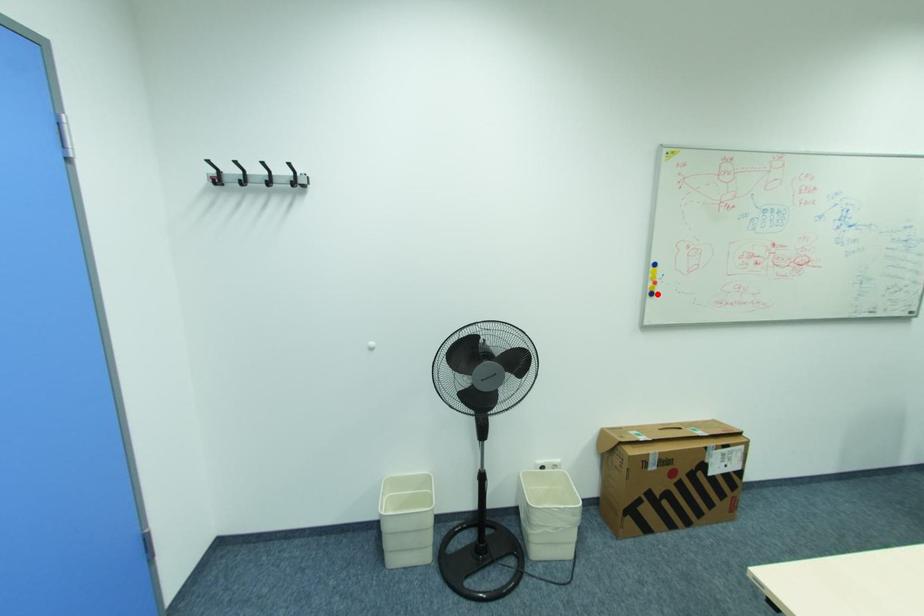
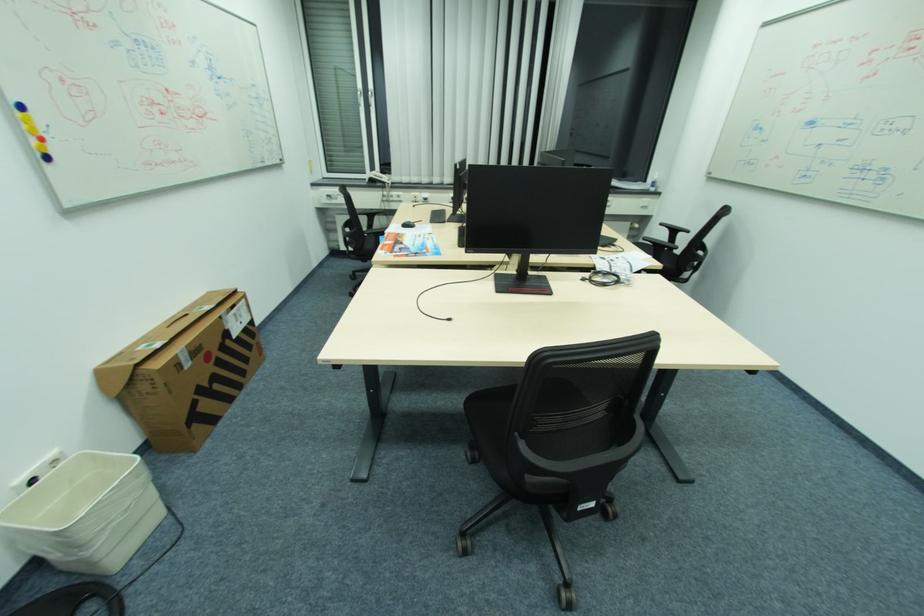
Question: I am providing you with two images of the same scene from different viewpoints. Image1 has a red point marked. In image2, the corresponding 3D location appears at what relative position? Reply with the corresponding letter.

Choices:
 (A) Closer
 (B) Farther

Answer: (B)